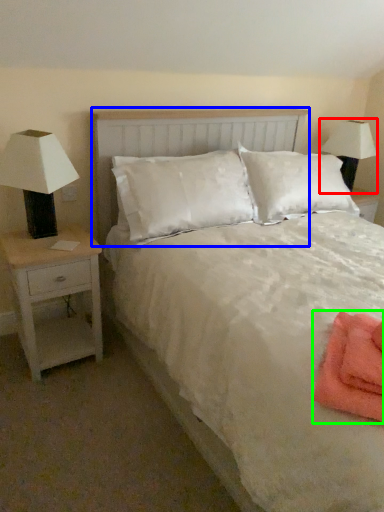
Question: Which object is the farthest from lamp (highlighted by a red box)? Choose among these: headboard (highlighted by a blue box) or material (highlighted by a green box).

Choices:
 (A) headboard
 (B) material

Answer: (B)